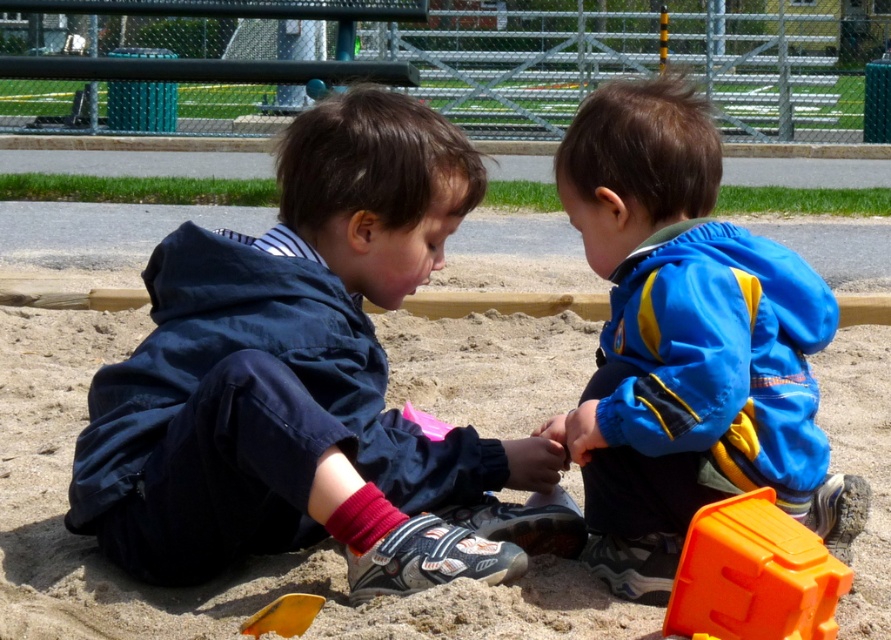
Between orange plastic shovel at lower left and pink plastic shovel at center, which one has more height?

With more height is orange plastic shovel at lower left.

Between point (300, 627) and point (428, 426), which one is positioned in front?

Point (300, 627)

The image size is (891, 640). I want to click on orange plastic shovel at lower left, so click(284, 616).

Which is in front, point (830, 580) or point (281, 611)?

Point (830, 580) is more forward.

Can you confirm if orange plastic toy at lower right is positioned to the right of orange plastic shovel at lower left?

Correct, you'll find orange plastic toy at lower right to the right of orange plastic shovel at lower left.

Which is in front, point (759, 605) or point (272, 614)?

Point (759, 605) is in front.

Where is `orange plastic toy at lower right`? The width and height of the screenshot is (891, 640). orange plastic toy at lower right is located at coordinates [753, 576].

In the scene shown: Can you confirm if orange plastic toy at lower right is positioned to the right of pink plastic shovel at center?

Indeed, orange plastic toy at lower right is positioned on the right side of pink plastic shovel at center.

Identify the location of orange plastic toy at lower right. This screenshot has width=891, height=640. (753, 576).